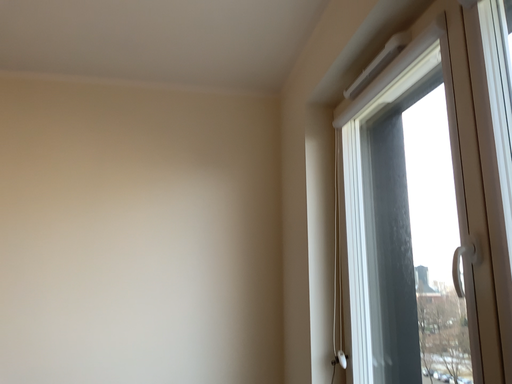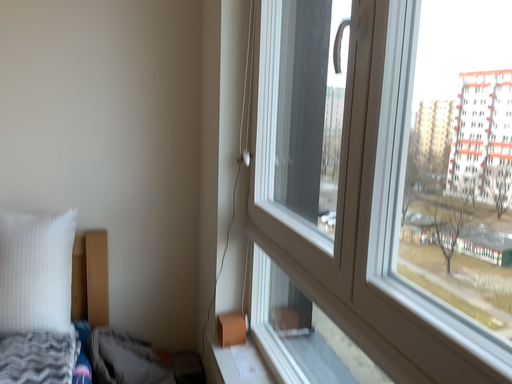
Question: Which way did the camera rotate in the video?

Choices:
 (A) rotated upward
 (B) rotated downward

Answer: (B)